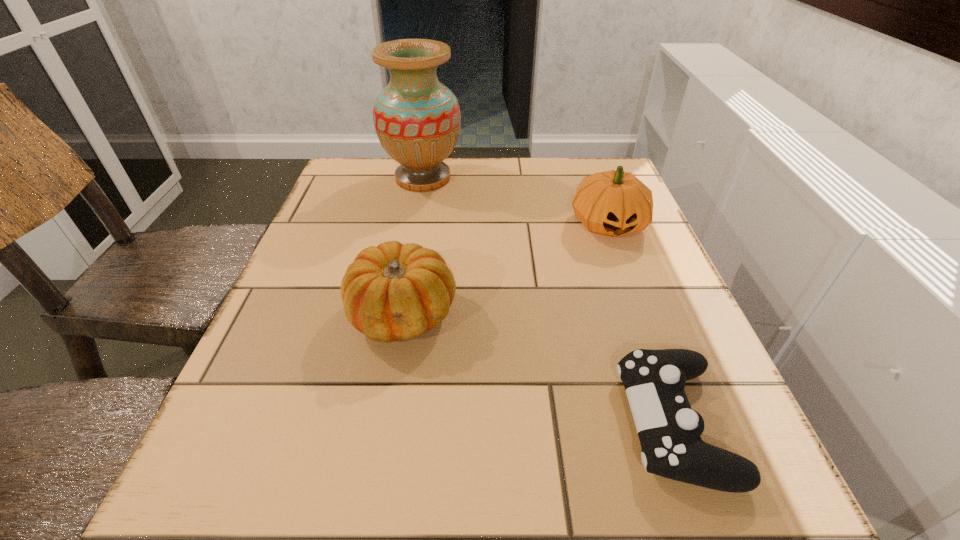
Where is `vacant space located 0.120m on the front of the shorter gourd`? The image size is (960, 540). vacant space located 0.120m on the front of the shorter gourd is located at coordinates (384, 422).

Identify the location of vacant space located on the surface of the nearest object. (398, 422).

This screenshot has width=960, height=540. In order to click on vacant space located 0.080m on the surface of the nearest object in this screenshot , I will do `click(569, 422)`.

Locate an element on the screen. vacant space located 0.270m on the surface of the nearest object is located at coordinates (440, 422).

You are a GUI agent. You are given a task and a screenshot of the screen. Output one action in this format:
    pyautogui.click(x=<x>, y=<y>)
    Task: Click on the vase that is positioned at the far edge
    This screenshot has width=960, height=540.
    Given the screenshot: What is the action you would take?
    pyautogui.click(x=417, y=119)

Find the location of `gourd that is at the far edge`. gourd that is at the far edge is located at coordinates point(613,203).

In order to click on object that is at the near edge in this screenshot , I will do `click(669, 430)`.

Where is `vase located at the left edge`? Image resolution: width=960 pixels, height=540 pixels. vase located at the left edge is located at coordinates (417, 119).

Where is `gourd located in the left edge section of the desktop`? Image resolution: width=960 pixels, height=540 pixels. gourd located in the left edge section of the desktop is located at coordinates coord(391,292).

This screenshot has height=540, width=960. I want to click on gourd located at the right edge, so pyautogui.click(x=613, y=203).